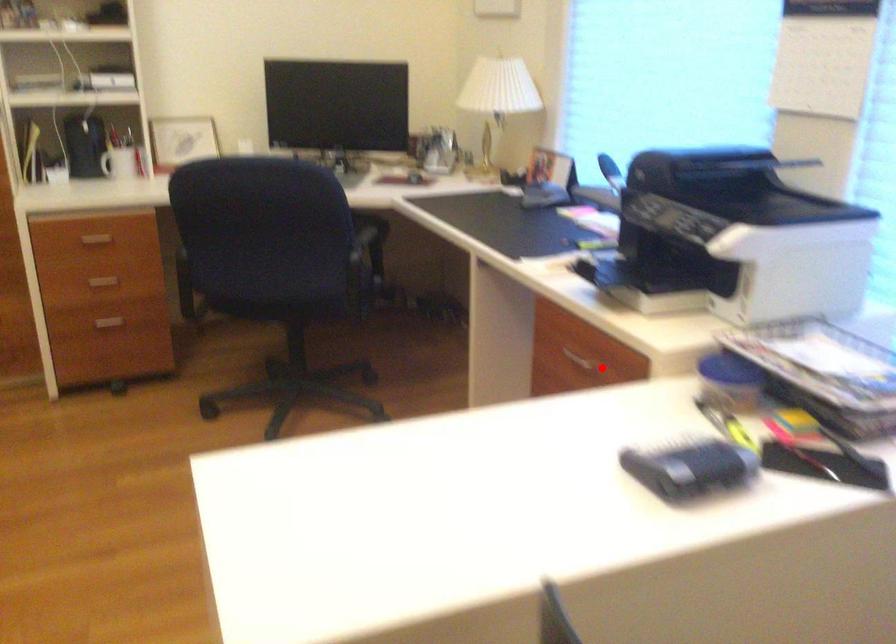
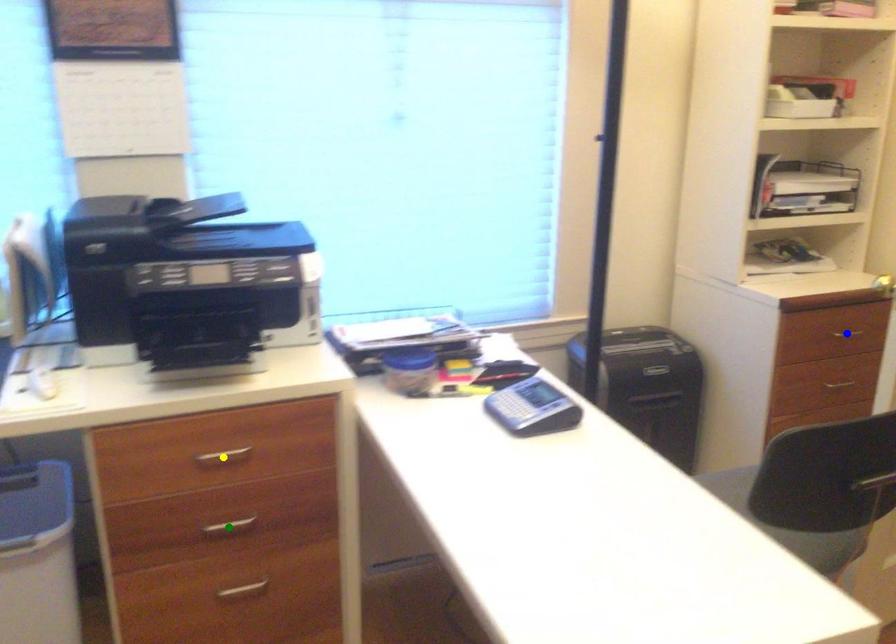
Question: I am providing you with two images of the same scene from different viewpoints. A red point is marked on the first image. You are given multiple points on the second image. Which spot in image 2 lines up with the point in image 1?

Choices:
 (A) blue point
 (B) green point
 (C) yellow point

Answer: (C)